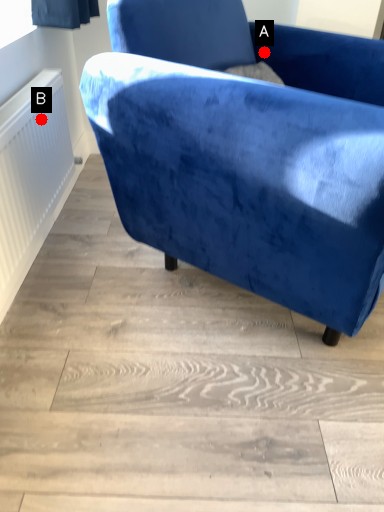
Question: Two points are circled on the image, labeled by A and B beside each circle. Which point is farther to the camera?

Choices:
 (A) A is further
 (B) B is further

Answer: (A)